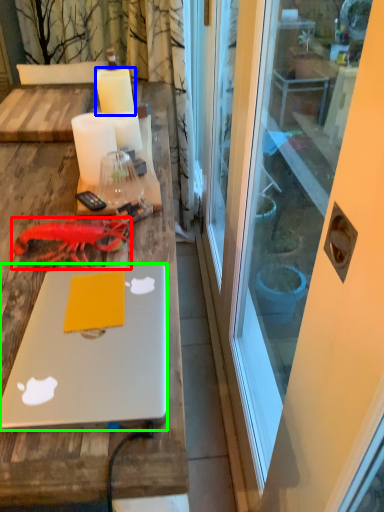
Question: Which object is positioned closest to lobster (highlighted by a red box)? Select from candle (highlighted by a blue box) and laptop (highlighted by a green box).

Choices:
 (A) candle
 (B) laptop

Answer: (B)